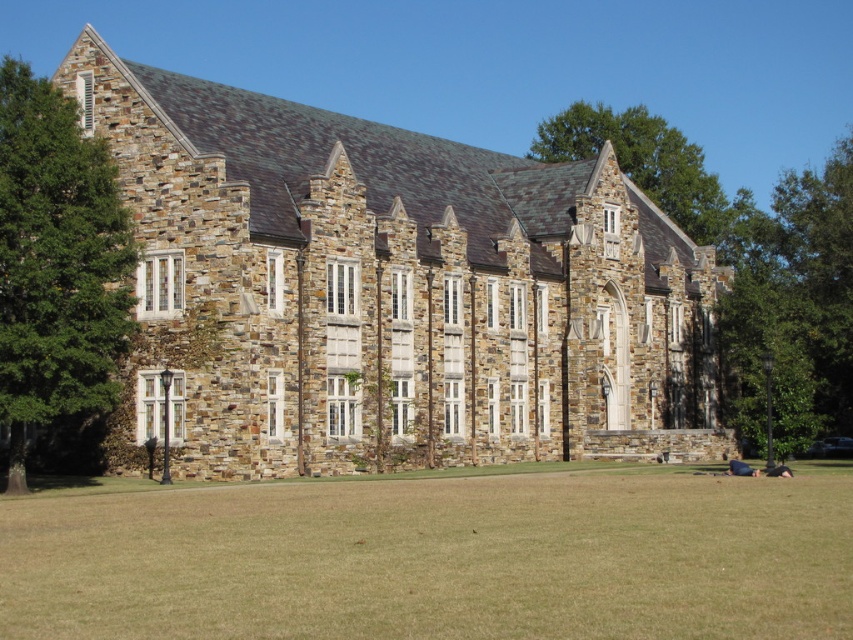
Question: Does green leafy tree at center appear under green leafy tree at left?

Choices:
 (A) no
 (B) yes

Answer: (B)

Question: Among these objects, which one is farthest from the camera?

Choices:
 (A) green leafy tree at upper right
 (B) green grass at lower center
 (C) green leafy tree at left
 (D) green leafy tree at center

Answer: (A)

Question: Among these points, which one is nearest to the camera?

Choices:
 (A) (737, 493)
 (B) (6, 205)
 (C) (851, 314)

Answer: (B)

Question: Which of the following is the closest to the observer?

Choices:
 (A) (828, 300)
 (B) (844, 160)

Answer: (A)

Question: Is green grass at lower center above green leafy tree at left?

Choices:
 (A) yes
 (B) no

Answer: (B)

Question: Is the position of green leafy tree at left more distant than that of green leafy tree at upper right?

Choices:
 (A) yes
 (B) no

Answer: (B)